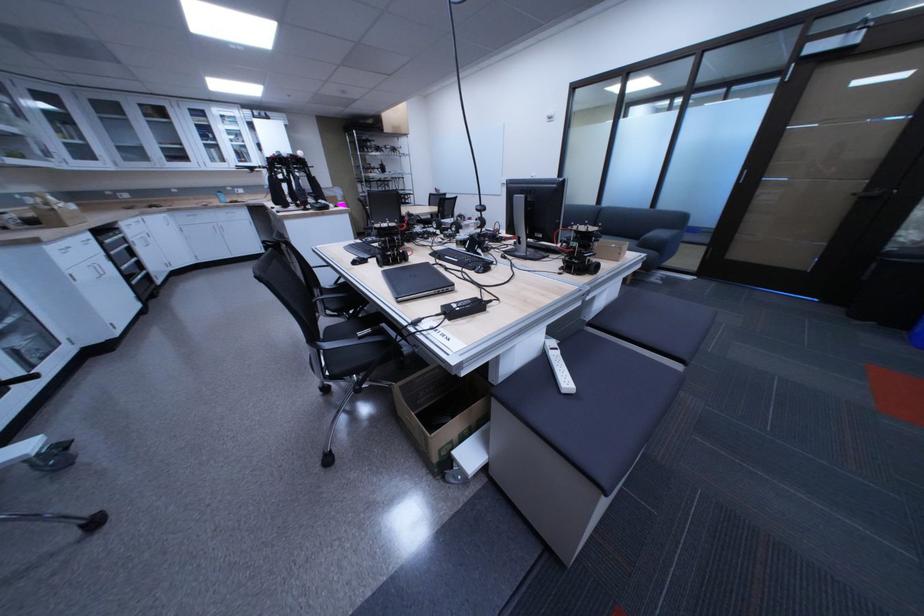
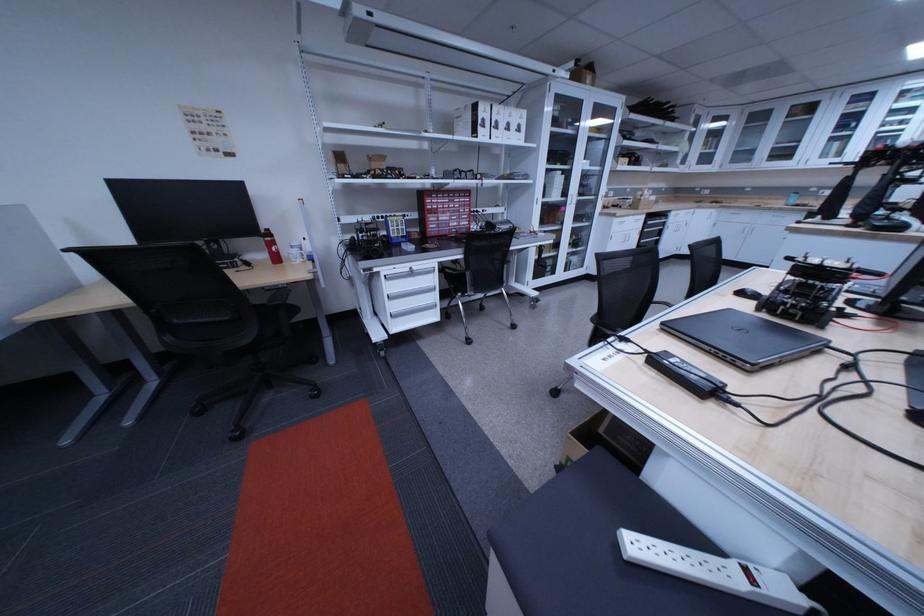
The point at [91,282] is marked in the first image. Where is the corresponding point in the second image?

(626, 241)